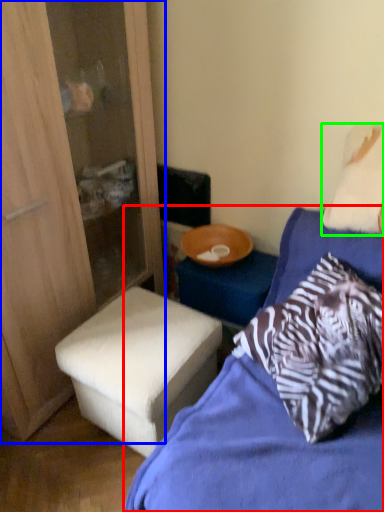
Question: Which is farther away from bed (highlighted by a red box)? dresser (highlighted by a blue box) or pillow (highlighted by a green box)?

Choices:
 (A) dresser
 (B) pillow

Answer: (A)